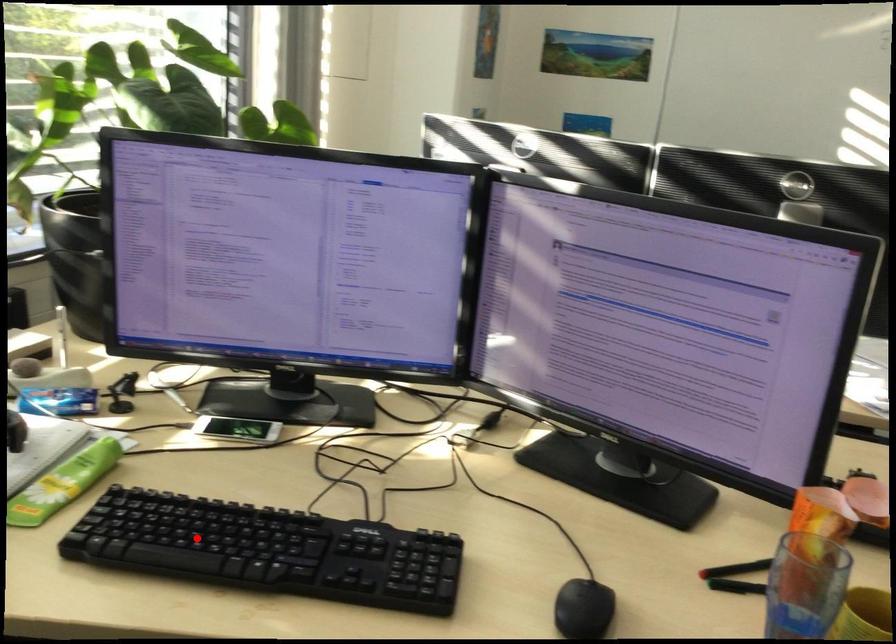
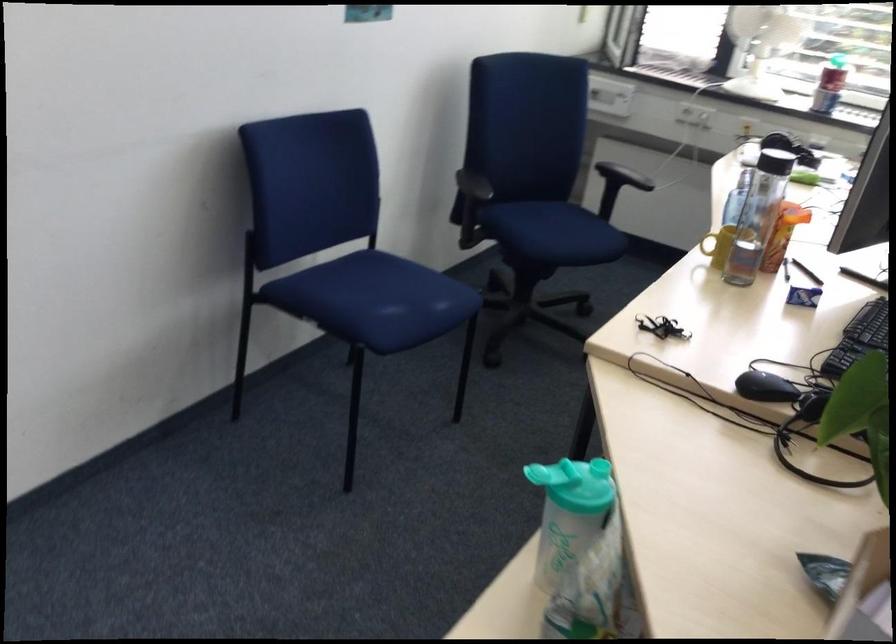
Question: I am providing you with two images of the same scene from different viewpoints. A red point is marked on the first image. Can you still see the location of the red point in image 2?

Choices:
 (A) Yes
 (B) No

Answer: (B)